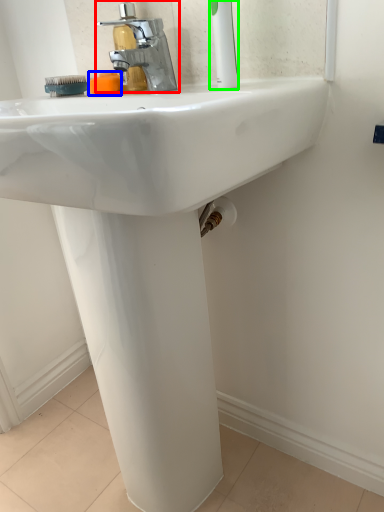
Question: Which object is the closest to the tap (highlighted by a red box)? Choose among these: soap (highlighted by a blue box) or toothbrush (highlighted by a green box).

Choices:
 (A) soap
 (B) toothbrush

Answer: (A)